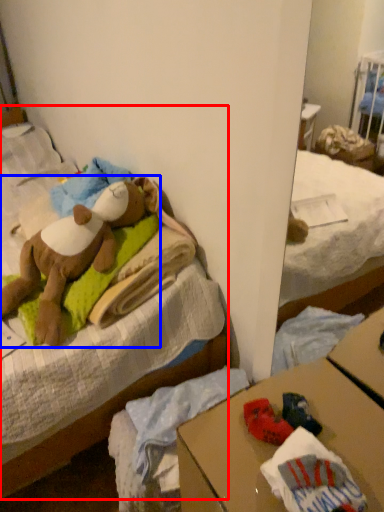
Question: Which object is further to the camera taking this photo, bed (highlighted by a red box) or teddy bear (highlighted by a blue box)?

Choices:
 (A) bed
 (B) teddy bear

Answer: (B)